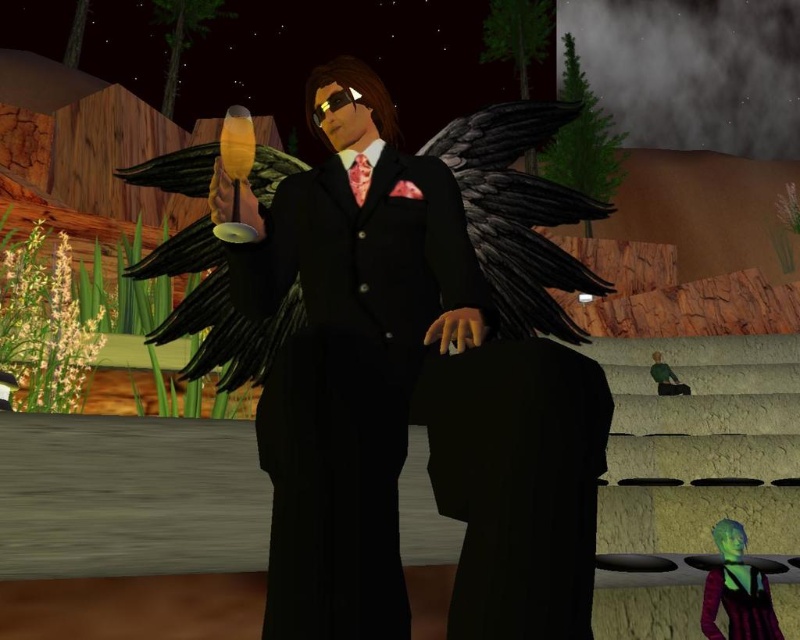
Does point (352, 60) come in front of point (754, 612)?

Yes.

Does black satin suit at center appear over purple striped dress at lower right?

Yes, black satin suit at center is above purple striped dress at lower right.

What do you see at coordinates (350, 353) in the screenshot?
I see `black satin suit at center` at bounding box center [350, 353].

You are a GUI agent. You are given a task and a screenshot of the screen. Output one action in this format:
    pyautogui.click(x=<x>, y=<y>)
    Task: Click on the black satin suit at center
    The image size is (800, 640).
    Given the screenshot: What is the action you would take?
    pyautogui.click(x=350, y=353)

Who is higher up, black matte wings at center or purple striped dress at lower right?

black matte wings at center is higher up.

Does black matte wings at center have a smaller size compared to purple striped dress at lower right?

No.

Who is more forward, (545, 252) or (710, 634)?

Point (545, 252) is in front.

Locate an element on the screen. black matte wings at center is located at coordinates (520, 214).

Can you confirm if black satin suit at center is taller than black matte wings at center?

Yes.

You are a GUI agent. You are given a task and a screenshot of the screen. Output one action in this format:
    pyautogui.click(x=<x>, y=<y>)
    Task: Click on the black satin suit at center
    
    Given the screenshot: What is the action you would take?
    pyautogui.click(x=350, y=353)

Is point (324, 540) in front of point (236, 376)?

Yes, point (324, 540) is closer to viewer.

Find the location of a particular element. black satin suit at center is located at coordinates 350,353.